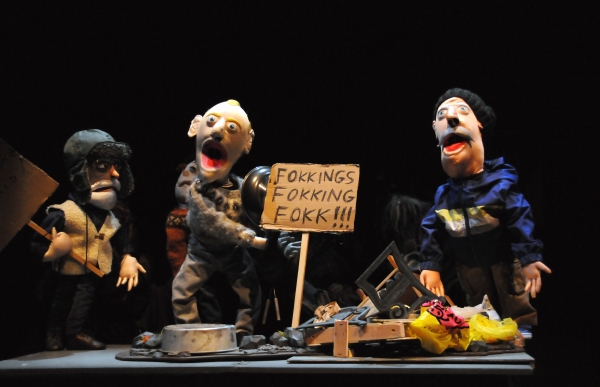
I want to click on overturned tin pan, so click(205, 340).